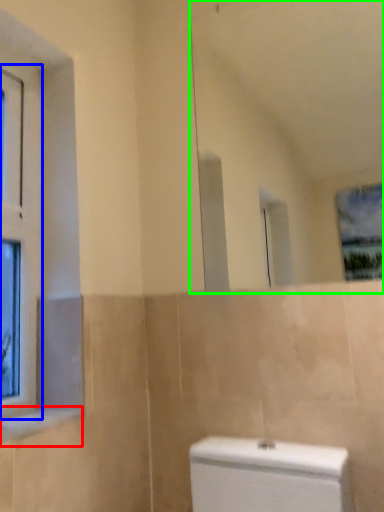
Question: Which is nearer to the window sill (highlighted by a red box)? window (highlighted by a blue box) or mirror (highlighted by a green box).

Choices:
 (A) window
 (B) mirror

Answer: (A)